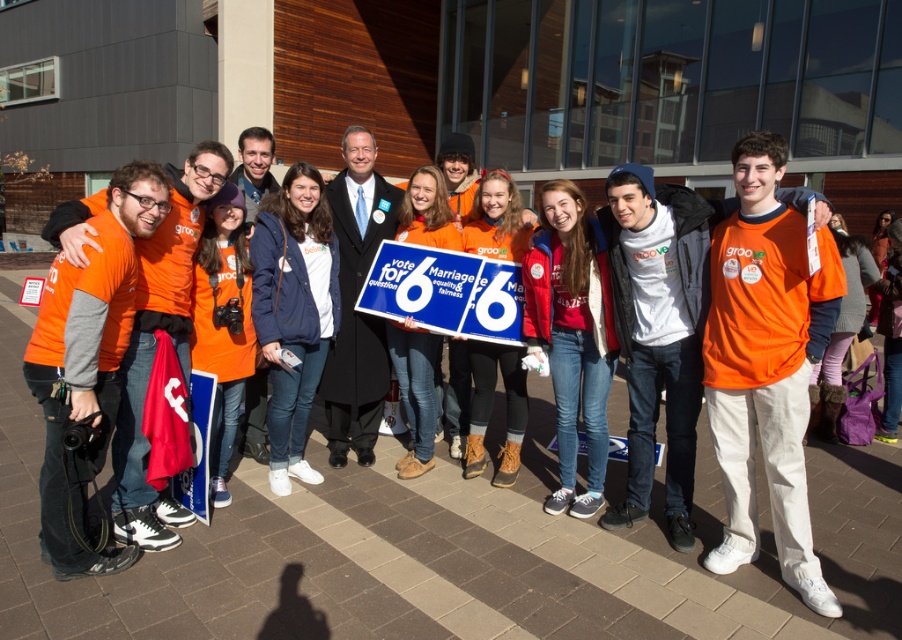
Question: Among these objects, which one is nearest to the camera?

Choices:
 (A) navy blue jacket at center
 (B) orange fleece jacket at center
 (C) orange matte jacket at center

Answer: (C)

Question: Which point appears closest to the camera in this image?

Choices:
 (A) (217, 384)
 (B) (603, 362)
 (C) (399, 284)

Answer: (A)

Question: Which point is farther from the camera taking this photo?

Choices:
 (A) (505, 417)
 (B) (565, 419)
 (C) (309, 474)

Answer: (A)

Question: Does red fleece jacket at center have a lesser width compared to white plastic sign at center?

Choices:
 (A) no
 (B) yes

Answer: (B)

Question: Can you confirm if navy blue jacket at center is wider than orange matte jacket at center?

Choices:
 (A) yes
 (B) no

Answer: (A)

Question: Does red fleece jacket at center appear over orange matte jacket at center?

Choices:
 (A) no
 (B) yes

Answer: (B)